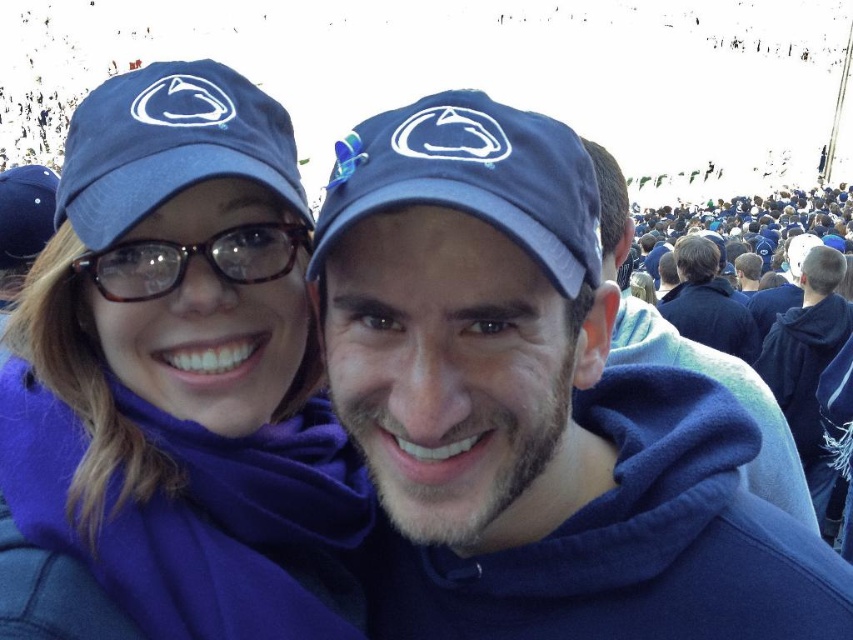
Question: Which point appears closest to the camera in this image?

Choices:
 (A) (514, 136)
 (B) (793, 449)
 (C) (827, 266)

Answer: (A)

Question: Does blue fleece jacket at right come in front of tortoiseshell plastic glasses at center?

Choices:
 (A) no
 (B) yes

Answer: (A)

Question: Can you confirm if matte blue cap at upper left is positioned to the left of blue fabric baseball cap at upper left?

Choices:
 (A) yes
 (B) no

Answer: (B)

Question: Among these objects, which one is nearest to the camera?

Choices:
 (A) blue fleece at center
 (B) tortoiseshell plastic glasses at center
 (C) matte blue cap at center
 (D) matte blue baseball cap at center

Answer: (C)

Question: Does blue fleece at center have a lesser width compared to blue fleece jacket at right?

Choices:
 (A) no
 (B) yes

Answer: (A)

Question: Which object appears farthest from the camera in this image?

Choices:
 (A) matte blue cap at center
 (B) matte blue cap at upper left
 (C) tortoiseshell plastic glasses at center
 (D) blue fleece jacket at right

Answer: (D)